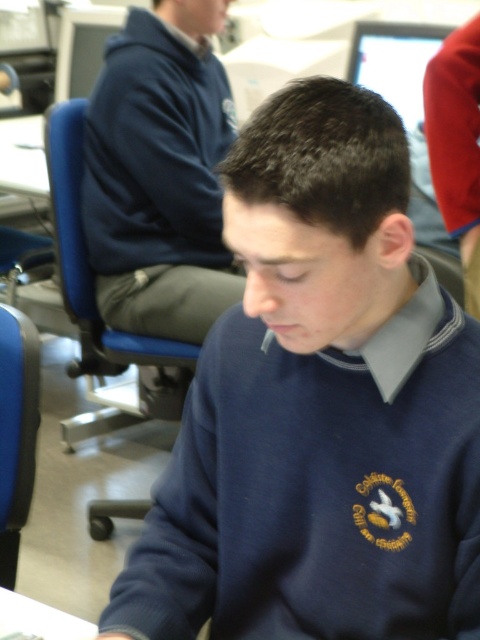
You are an observer in the room. You notice the navy blue sweater at center and the dark blue hoodie at upper left. Which clothing item appears taller in the image?

The dark blue hoodie at upper left appears taller because the navy blue sweater at center is not as tall as it.